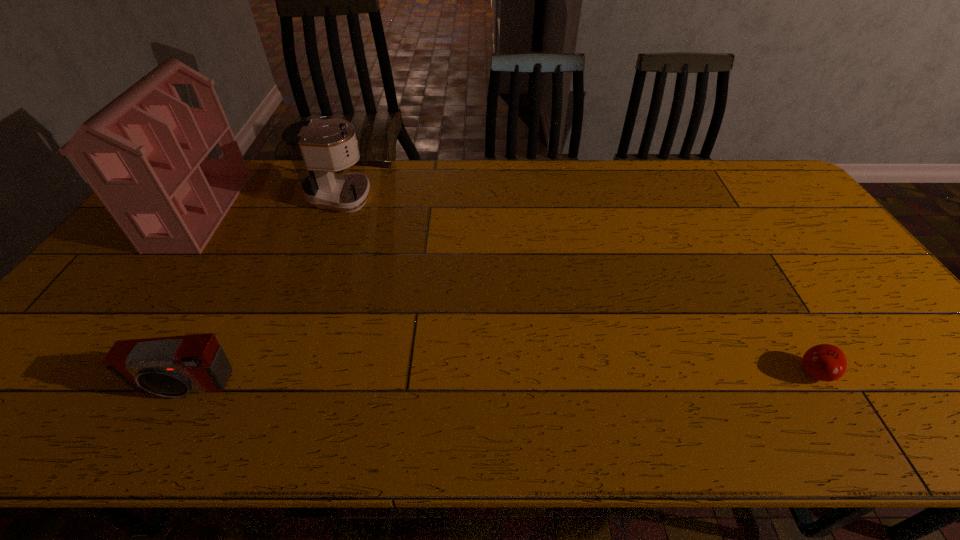
The width and height of the screenshot is (960, 540). What are the coordinates of `coffee maker that is positioned at the far edge` in the screenshot? It's located at (317, 148).

Where is `object located in the near edge section of the desktop`? object located in the near edge section of the desktop is located at coordinates (173, 366).

Identify the location of object at the left edge. (145, 154).

Find the location of `object that is at the far left corner`. object that is at the far left corner is located at coordinates (145, 154).

In the image, there is a desktop. Identify the location of vacant space at the far edge. (276, 177).

The image size is (960, 540). Identify the location of vacant space at the near edge of the desktop. (563, 404).

Where is `free space at the left edge of the desktop`? free space at the left edge of the desktop is located at coordinates (57, 388).

At what (x,y) coordinates should I click in order to perform the action: click on free point at the right edge. Please return your answer as a coordinate pair (x, y). The width and height of the screenshot is (960, 540). Looking at the image, I should click on (796, 262).

Where is `vacant region between the coffee maker and the third tallest object`? This screenshot has height=540, width=960. vacant region between the coffee maker and the third tallest object is located at coordinates (268, 292).

The height and width of the screenshot is (540, 960). In order to click on vacant point located between the second shortest object and the shortest object in this screenshot , I will do `click(500, 380)`.